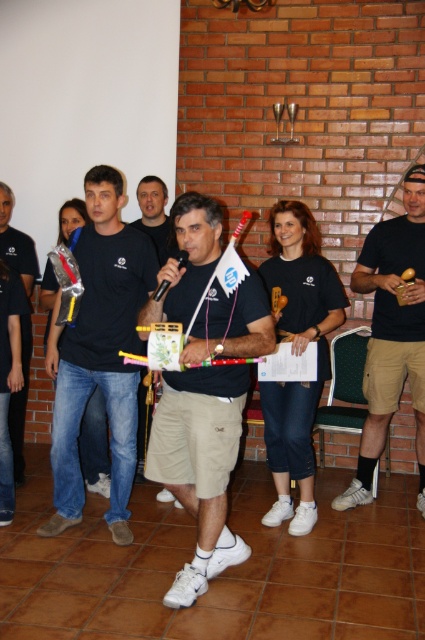
Question: Can you confirm if brown fabric shorts at right is smaller than wooden maraca at center?

Choices:
 (A) yes
 (B) no

Answer: (B)

Question: Among these objects, which one is nearest to the camera?

Choices:
 (A) brown fabric shorts at right
 (B) black cotton t-shirt at left

Answer: (A)

Question: Does matte khaki shorts at center have a larger size compared to brown fabric shorts at right?

Choices:
 (A) yes
 (B) no

Answer: (A)

Question: Estimate the real-world distances between objects in this image. Which object is farther from the black cotton shirt at center?

Choices:
 (A) black matte t-shirt at center
 (B) matte khaki shorts at center
 (C) wooden maraca at center

Answer: (C)

Question: Is matte khaki shorts at center wider than black cotton shirt at center?

Choices:
 (A) yes
 (B) no

Answer: (B)

Question: Which point appears closest to the camera in this image?

Choices:
 (A) (164, 497)
 (B) (14, 260)

Answer: (A)